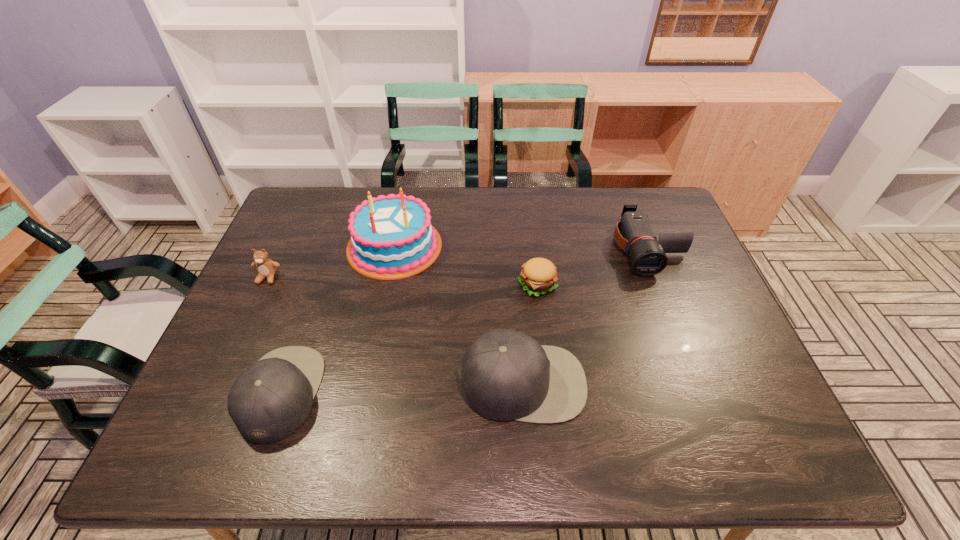
Locate an element on the screen. The height and width of the screenshot is (540, 960). the shorter cap is located at coordinates (270, 400).

Identify the location of the right cap. (505, 374).

Image resolution: width=960 pixels, height=540 pixels. I want to click on the fifth shortest object, so click(x=505, y=374).

I want to click on the tallest object, so click(391, 237).

Find the location of `camcorder`. camcorder is located at coordinates (633, 233).

Where is `the shortest object`? This screenshot has width=960, height=540. the shortest object is located at coordinates (538, 276).

Find the location of a particular element. This screenshot has width=960, height=540. the leftmost object is located at coordinates (266, 268).

The height and width of the screenshot is (540, 960). Identify the location of free location located 0.140m on the brim of the shorter cap. pyautogui.click(x=378, y=393).

Where is `vacant region located 0.250m on the front of the tallest object`? Image resolution: width=960 pixels, height=540 pixels. vacant region located 0.250m on the front of the tallest object is located at coordinates (373, 353).

What are the coordinates of `blank area located on the lens of the camcorder` in the screenshot? It's located at (665, 292).